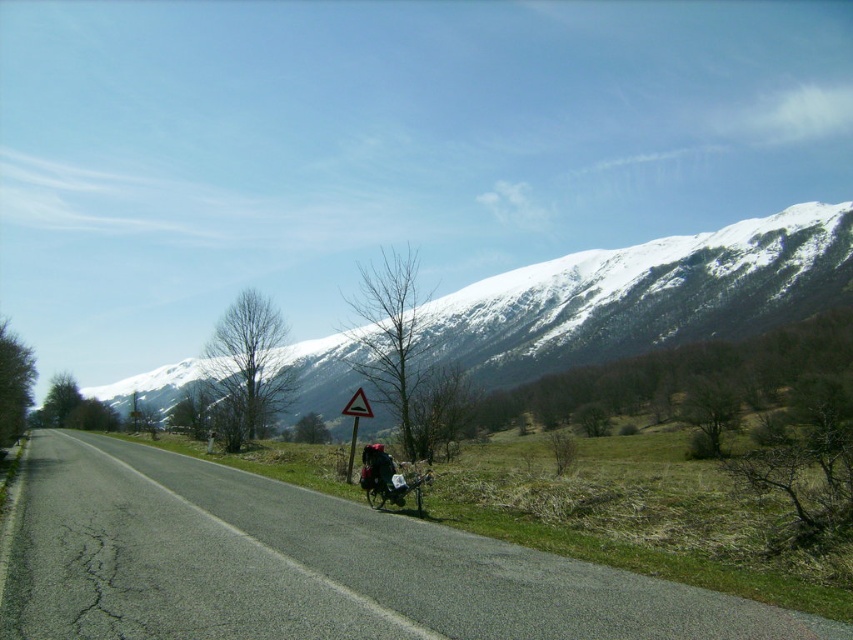
You are a cyclist planning to ride along the asphalt road at center. There is a triangular reflective plastic traffic sign at center nearby. Which object is shorter in height?

The asphalt road at center is shorter than the triangular reflective plastic traffic sign at center.

You are a cyclist approaching the scene and notice the asphalt road at center and the triangular reflective plastic traffic sign at center. Which object is closer to the cyclist?

The asphalt road at center is positioned under the triangular reflective plastic traffic sign at center, so the cyclist would be closer to the asphalt road at center since it is underneath the sign.

You are a photographer planning to capture a wide shot of the snowy mountain at upper center and the metallic silver motorcycle at center. Based on their relative sizes in the image, which object would appear larger in your photograph?

The snowy mountain at upper center might appear larger than the metallic silver motorcycle at center because it is wider according to the description.